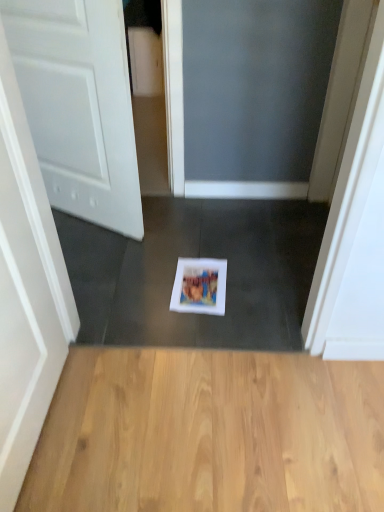
Question: Is white matte door at left taller or shorter than white paper at center?

Choices:
 (A) short
 (B) tall

Answer: (B)

Question: Considering their positions, is white matte door at left located in front of or behind white paper at center?

Choices:
 (A) front
 (B) behind

Answer: (A)

Question: Which of these objects is positioned farthest from the light brown wood flooring at center?

Choices:
 (A) white paper at center
 (B) white matte door at left

Answer: (B)

Question: Estimate the real-world distances between objects in this image. Which object is farther from the white matte door at left?

Choices:
 (A) light brown wood flooring at center
 (B) white paper at center

Answer: (A)